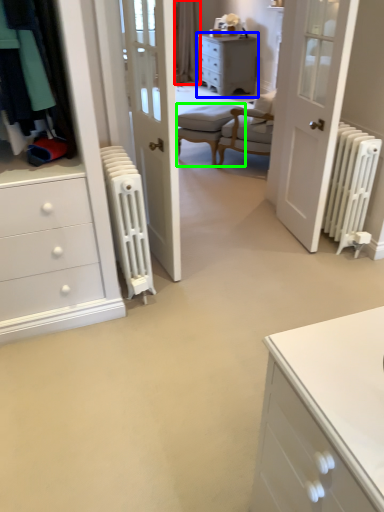
Question: Considering the real-world distances, which object is farthest from curtain (highlighted by a red box)? chest of drawers (highlighted by a blue box) or armchair (highlighted by a green box)?

Choices:
 (A) chest of drawers
 (B) armchair

Answer: (B)